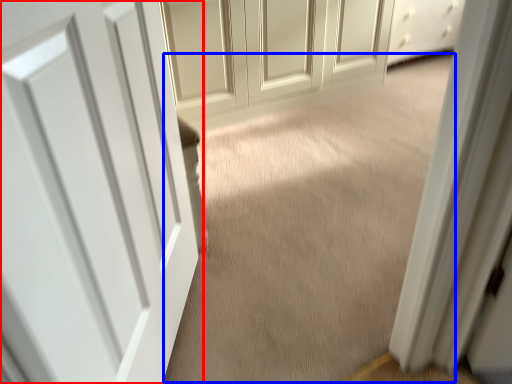
Question: Which object is further to the camera taking this photo, door (highlighted by a red box) or plain (highlighted by a blue box)?

Choices:
 (A) door
 (B) plain

Answer: (B)